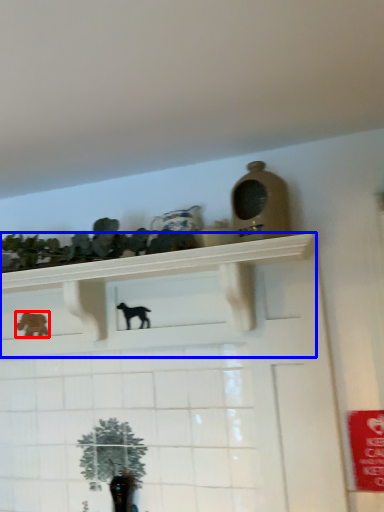
Question: Which object is further to the camera taking this photo, animal (highlighted by a red box) or shelf (highlighted by a blue box)?

Choices:
 (A) animal
 (B) shelf

Answer: (A)